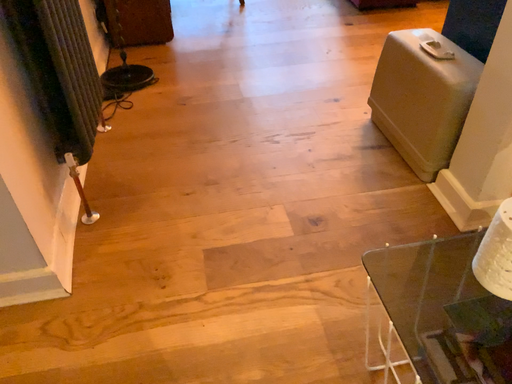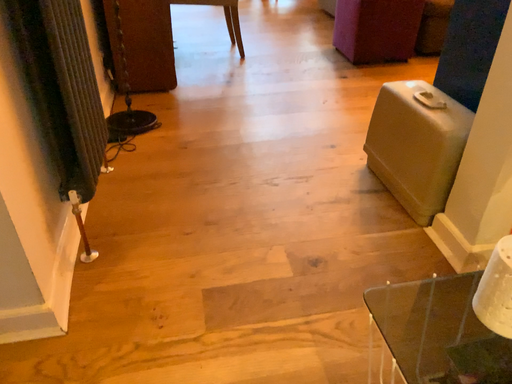
Question: How did the camera likely rotate when shooting the video?

Choices:
 (A) rotated upward
 (B) rotated downward

Answer: (A)